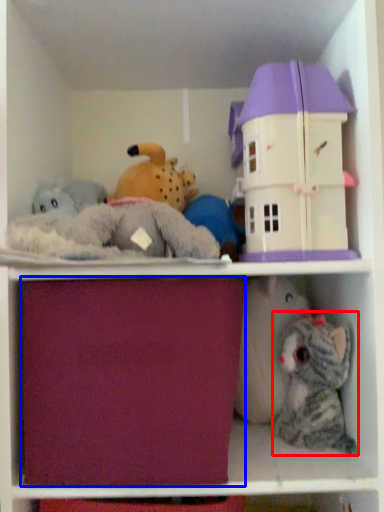
Question: Which point is further to the camera, toy (highlighted by a red box) or drawer (highlighted by a blue box)?

Choices:
 (A) toy
 (B) drawer

Answer: (A)